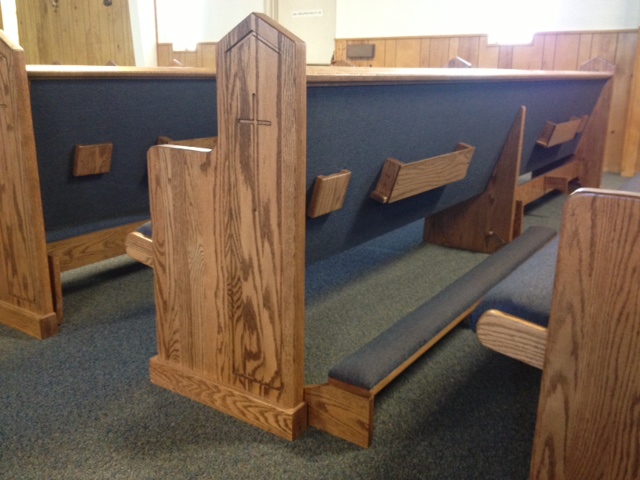
You are a GUI agent. You are given a task and a screenshot of the screen. Output one action in this format:
    pyautogui.click(x=<x>, y=<y>)
    Task: Click on the church wall panels
    
    Given the screenshot: What is the action you would take?
    pyautogui.click(x=554, y=50), pyautogui.click(x=425, y=48), pyautogui.click(x=195, y=55)